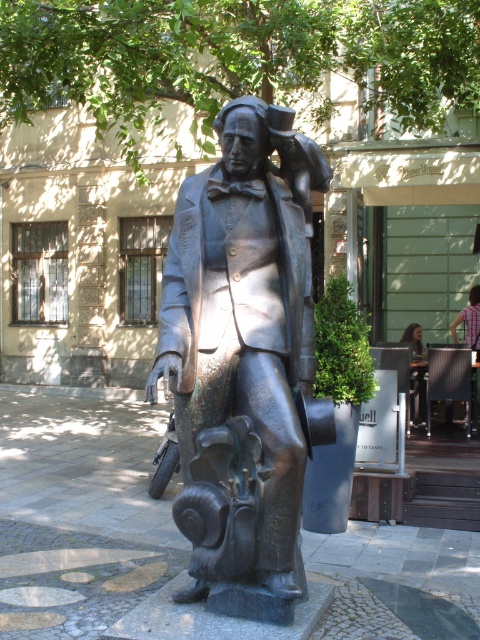
You are an artist standing in front of the bronze statue in the plaza. You notice a plaid fabric shirt at upper right and a dark hair person at center in the scene. Which object is covering the other one?

The plaid fabric shirt at upper right is positioned over dark hair person at center, so it is covering the person.

You are standing in the plaza and see the bronze statue at center. Where is the point located at coordinates (242, 358)?

The point at coordinates (242, 358) is on the bronze statue at center.